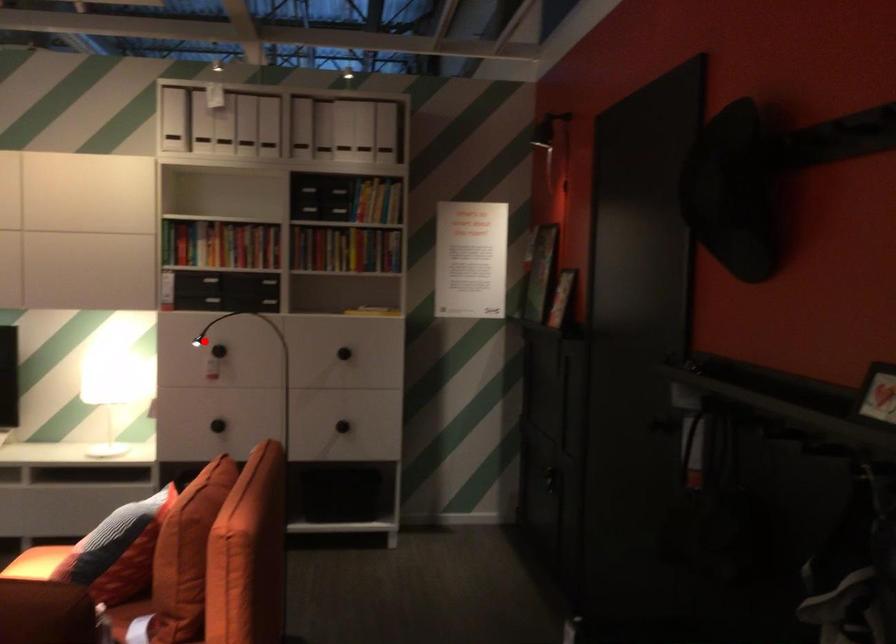
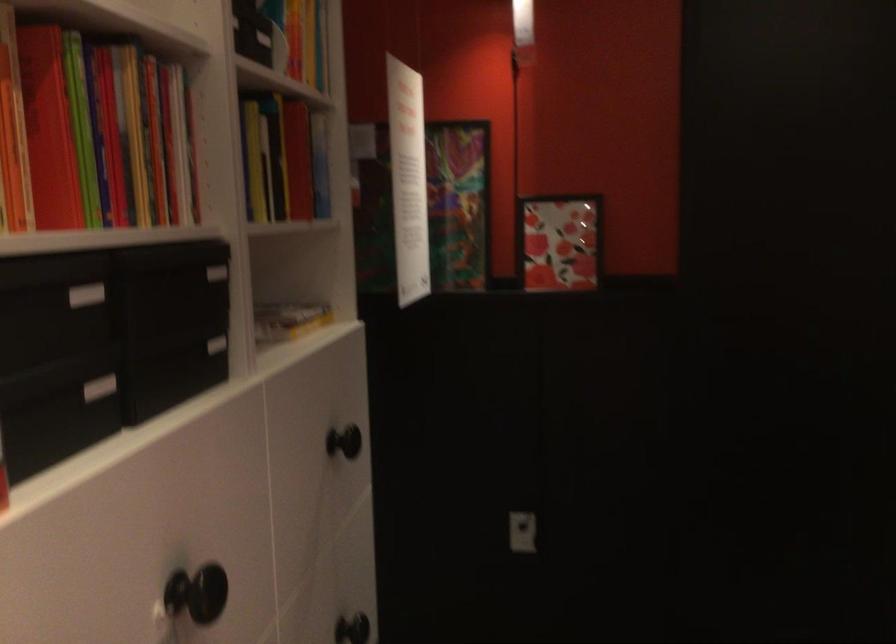
Locate, in the second image, the point that corresponds to the highlighted location in the first image.

(196, 592)